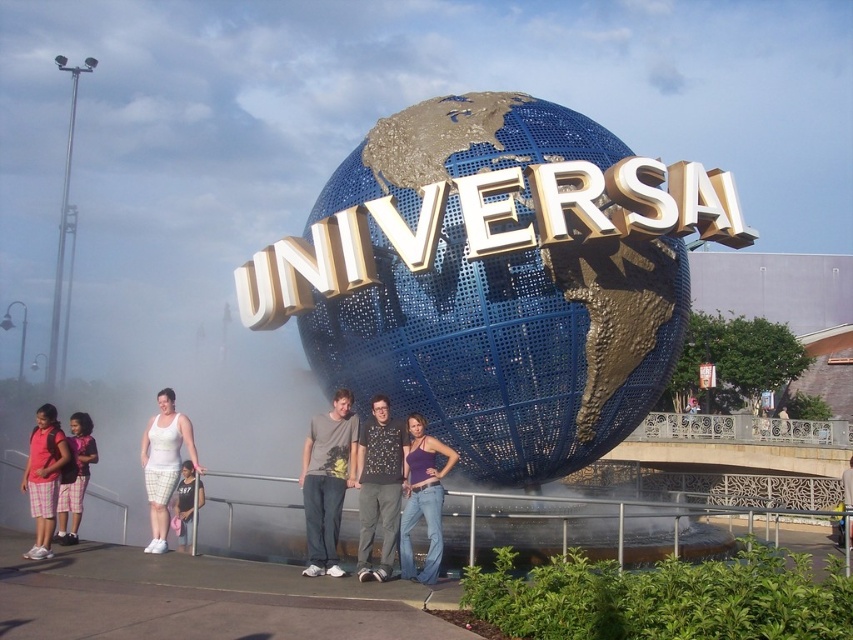
Is purple fabric top at center bigger than matte white shorts at lower left?

Yes.

Describe the element at coordinates (422, 499) in the screenshot. I see `purple fabric top at center` at that location.

The height and width of the screenshot is (640, 853). I want to click on purple fabric top at center, so click(422, 499).

Between purple fabric top at center and white cotton tank top at lower left, which one appears on the left side from the viewer's perspective?

white cotton tank top at lower left

Who is more forward, (422, 481) or (177, 529)?

Positioned in front is point (422, 481).

Locate an element on the screen. purple fabric top at center is located at coordinates (422, 499).

Does matte gray t-shirt at center appear on the right side of plaid shorts at lower left?

Correct, you'll find matte gray t-shirt at center to the right of plaid shorts at lower left.

Consider the image. Between matte gray t-shirt at center and plaid shorts at lower left, which one appears on the right side from the viewer's perspective?

Positioned to the right is matte gray t-shirt at center.

Image resolution: width=853 pixels, height=640 pixels. Identify the location of matte gray t-shirt at center. (328, 481).